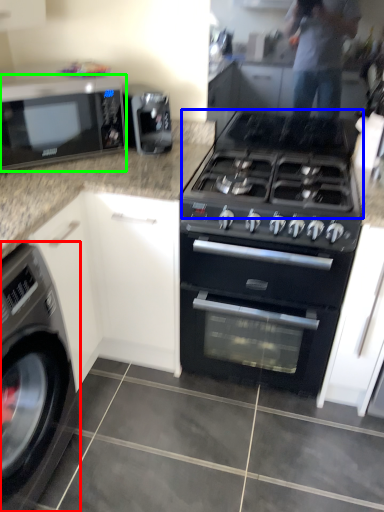
Question: Based on their relative distances, which object is nearer to washing machine (highlighted by a red box)? Choose from gas stove (highlighted by a blue box) and microwave oven (highlighted by a green box).

Choices:
 (A) gas stove
 (B) microwave oven

Answer: (B)